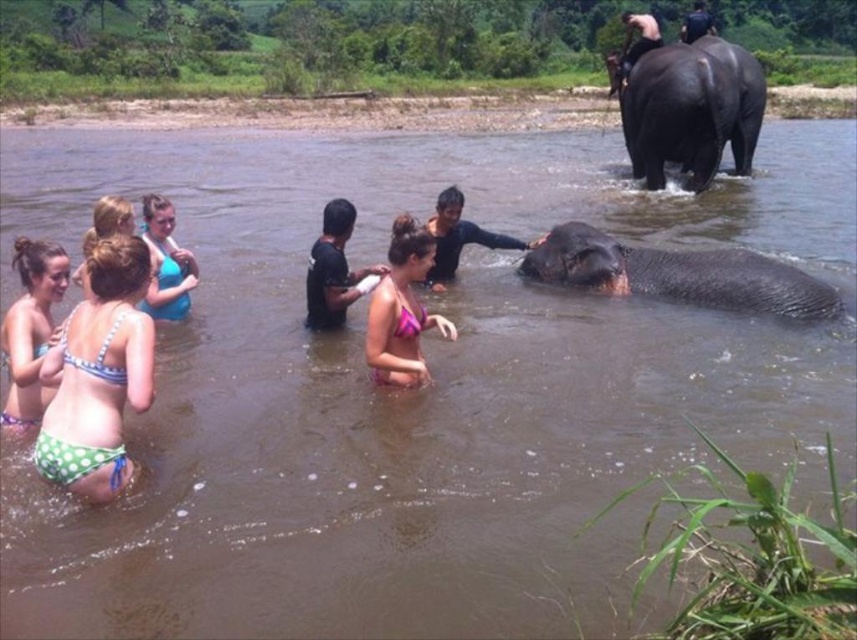
You are standing at the riverbank and want to reach the point marked by coordinates point (746, 308). If your maximum comfortable walking distance is 30 feet, will you be able to reach it without feeling uncomfortable?

The distance of point (746, 308) from viewer is 33.73 feet, which exceeds your maximum comfortable walking distance of 30 feet. Therefore, you might feel uncomfortable reaching it.

You are standing at the point with coordinates point (x=442, y=253) and want to move towards the point with coordinates point (x=640, y=262). Is the point you want to reach located in front of or behind you?

The point (x=640, y=262) is in front of point (x=442, y=253), so the destination is located in front of you.